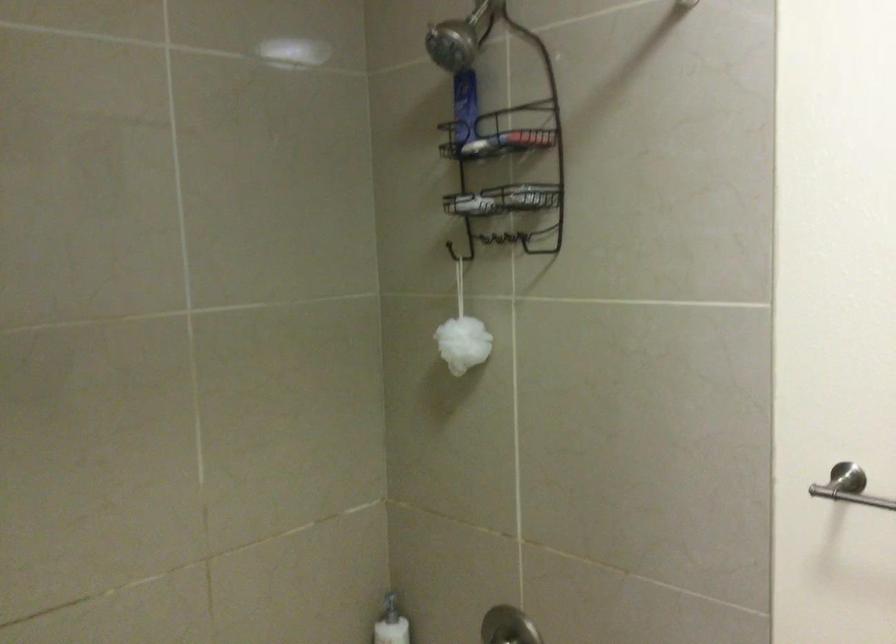
The width and height of the screenshot is (896, 644). I want to click on blue shampoo bottle, so click(464, 105).